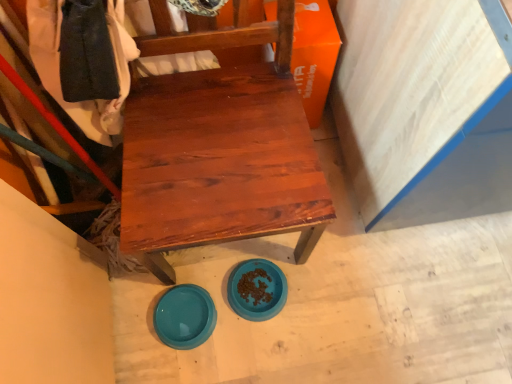
This screenshot has height=384, width=512. I want to click on free space on the front side of teal glossy plate at lower center, arranged as the 1th plate when viewed from the left, so click(183, 367).